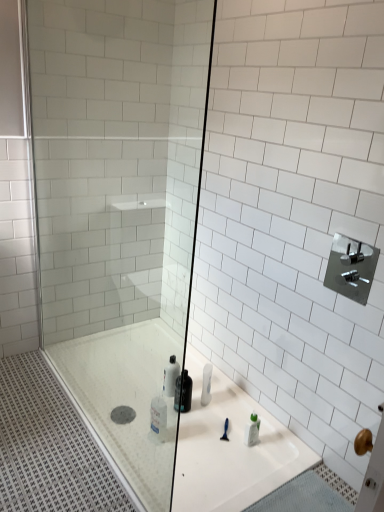
Question: Considering the positions of point (345, 267) and point (187, 384), is point (345, 267) closer or farther from the camera than point (187, 384)?

Choices:
 (A) closer
 (B) farther

Answer: (B)

Question: Which is correct: satin nickel faucet at upper right is inside translucent plastic bottle at center, or outside of it?

Choices:
 (A) outside
 (B) inside

Answer: (A)

Question: Which is farther from the transparent glass shower door at center?

Choices:
 (A) translucent plastic bottle at center
 (B) satin nickel faucet at upper right

Answer: (B)

Question: Estimate the real-world distances between objects in this image. Which object is farther from the translucent plastic bottle at center?

Choices:
 (A) satin nickel faucet at upper right
 (B) transparent glass shower door at center

Answer: (A)